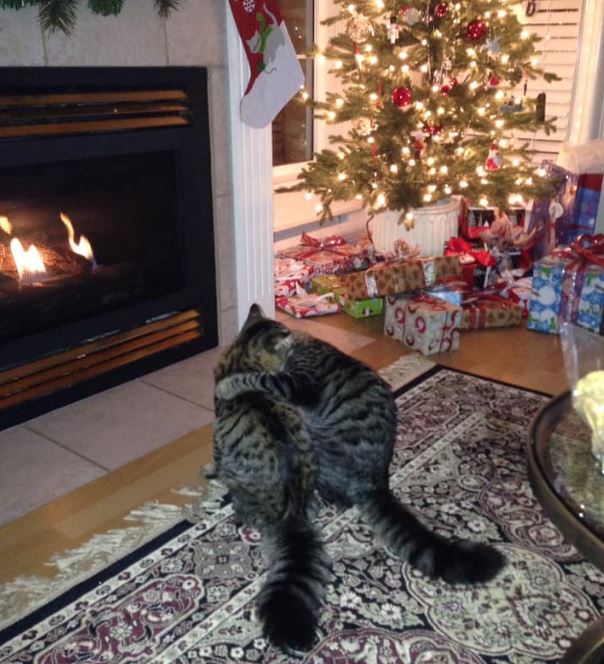
Where is `wreaths`? This screenshot has width=604, height=664. wreaths is located at coordinates (63, 13), (104, 2), (164, 8), (11, 0).